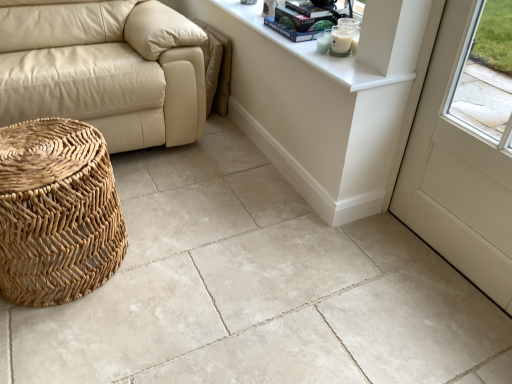
This screenshot has height=384, width=512. I want to click on vacant space in front of white matte screen door at lower right, so click(444, 319).